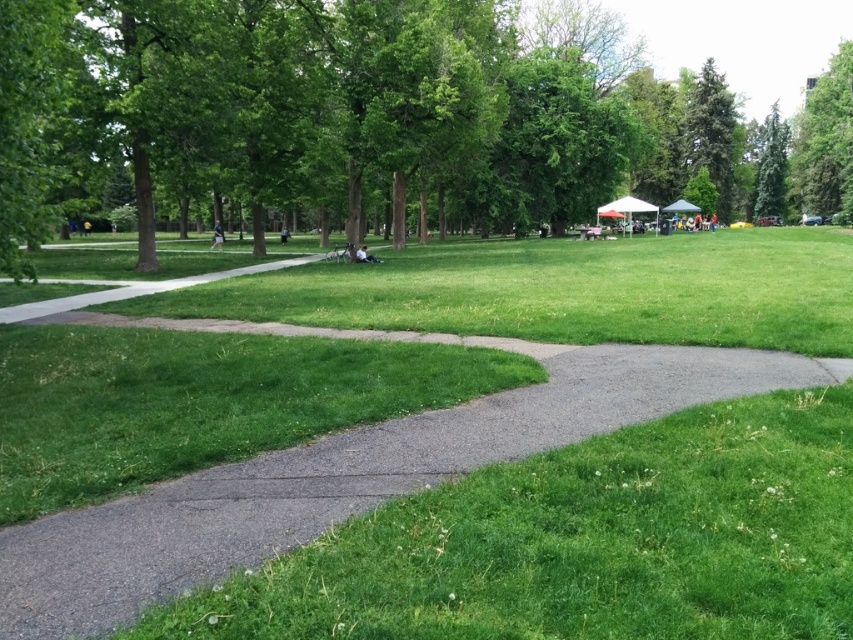
Does point (833, 81) come closer to viewer compared to point (776, 192)?

Yes, point (833, 81) is closer to viewer.

Is green leafy tree at upper right wider than green textured tree at upper right?

Correct, the width of green leafy tree at upper right exceeds that of green textured tree at upper right.

Locate an element on the screen. green leafy tree at upper right is located at coordinates (825, 141).

Locate an element on the screen. The image size is (853, 640). green leafy tree at upper right is located at coordinates (825, 141).

Is green leafy tree at upper right to the left of white canopy at upper right from the viewer's perspective?

In fact, green leafy tree at upper right is to the right of white canopy at upper right.

Does green leafy tree at upper right come behind white canopy at upper right?

That is True.

This screenshot has width=853, height=640. I want to click on green leafy tree at upper right, so click(x=825, y=141).

Image resolution: width=853 pixels, height=640 pixels. Find the location of `green leafy tree at upper right`. green leafy tree at upper right is located at coordinates (825, 141).

Looking at this image, is green grass at center smaller than green leafy tree at upper right?

Yes.

Is green grass at center to the right of green leafy tree at upper right from the viewer's perspective?

No, green grass at center is not to the right of green leafy tree at upper right.

Is point (567, 525) less distant than point (834, 180)?

Yes, point (567, 525) is closer to viewer.

Find the location of a particular element. green grass at center is located at coordinates (585, 541).